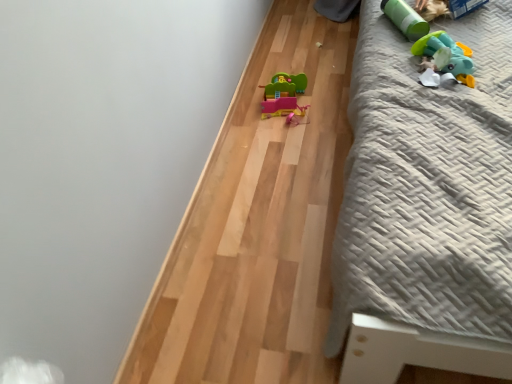
Where is `vacant space in front of matte plastic toy car at center, which is the 1th toy in back-to-front order`? This screenshot has width=512, height=384. vacant space in front of matte plastic toy car at center, which is the 1th toy in back-to-front order is located at coordinates (291, 139).